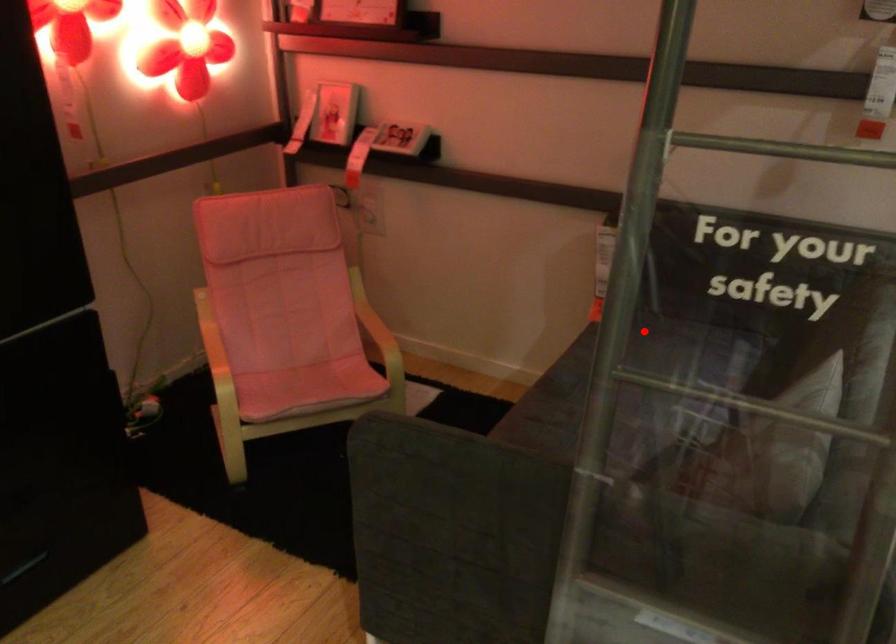
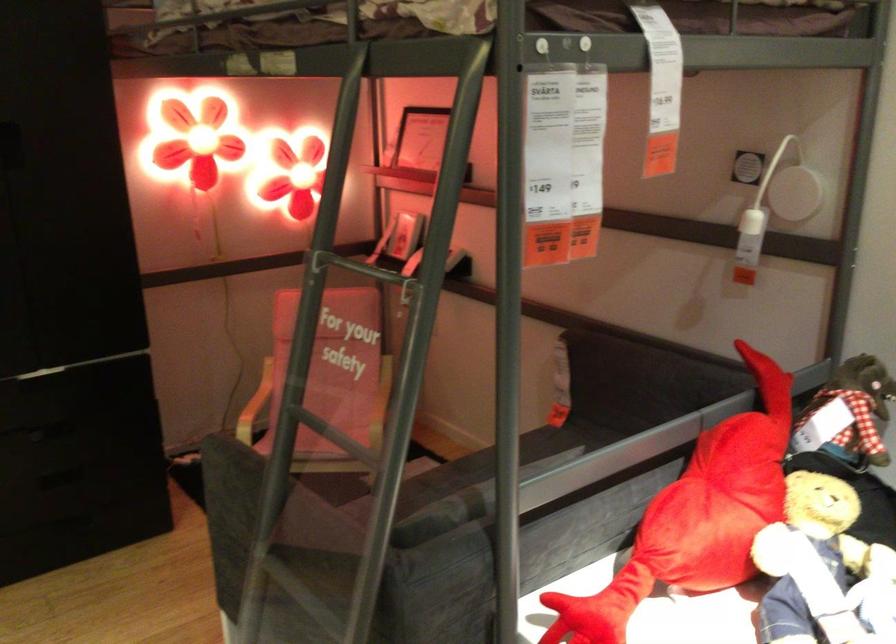
Question: I am providing you with two images of the same scene from different viewpoints. A red point is shown in image1. For the corresponding object point in image2, is it positioned nearer or farther from the camera?

Choices:
 (A) Nearer
 (B) Farther

Answer: (B)